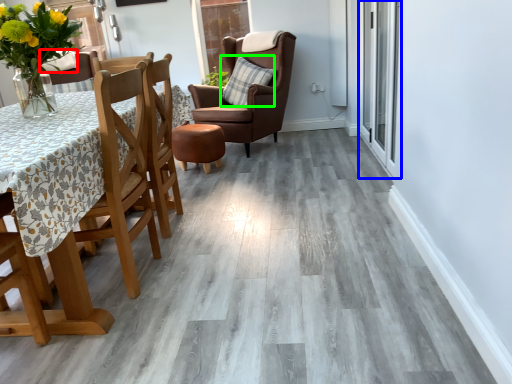
Question: Which object is positioned closest to pillow (highlighted by a red box)? Select from glass door (highlighted by a blue box) and pillow (highlighted by a green box).

Choices:
 (A) glass door
 (B) pillow

Answer: (B)